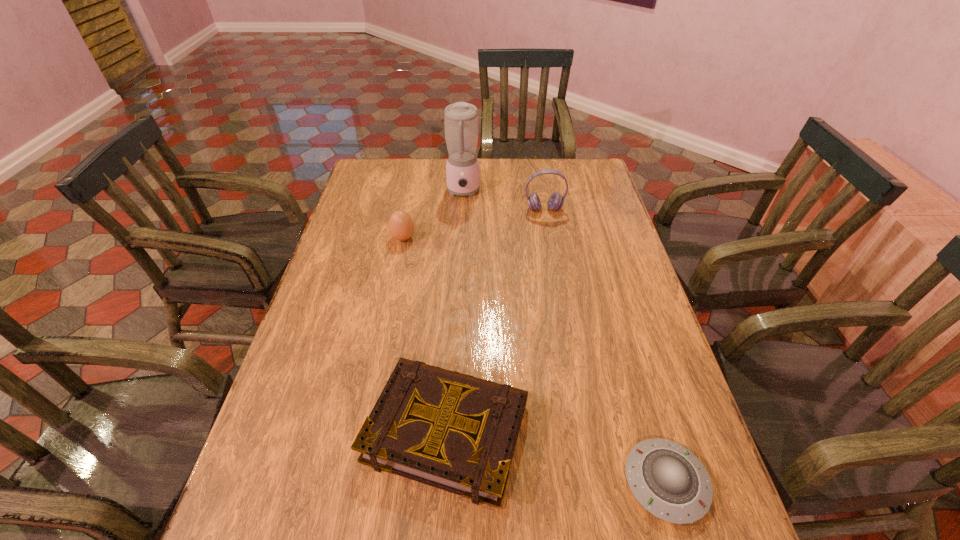
This screenshot has width=960, height=540. In order to click on the tallest object in this screenshot , I will do `click(460, 119)`.

I want to click on food processor, so click(x=460, y=119).

Where is `the second farthest object`? the second farthest object is located at coordinates (556, 201).

What are the coordinates of `headset` in the screenshot? It's located at (556, 201).

The image size is (960, 540). What are the coordinates of `boiled egg` in the screenshot? It's located at 401,226.

Identify the location of the third tallest object. (401, 226).

Where is `the second shortest object`? This screenshot has width=960, height=540. the second shortest object is located at coordinates (453, 431).

Where is `saucer`? This screenshot has width=960, height=540. saucer is located at coordinates (668, 480).

At what (x,y) coordinates should I click in order to perform the action: click on free space located on the base of the farthest object near the control knob. Please return your answer as a coordinate pair (x, y). This screenshot has width=960, height=540. Looking at the image, I should click on (462, 218).

What are the coordinates of `free space located on the headband and ear cups of the fourth nearest object` in the screenshot? It's located at (549, 237).